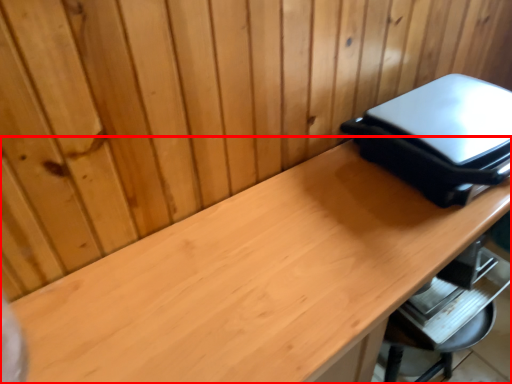
Question: From the image's perspective, what is the correct spatial relationship of desk (annotated by the red box) in relation to appliance?

Choices:
 (A) above
 (B) below

Answer: (B)